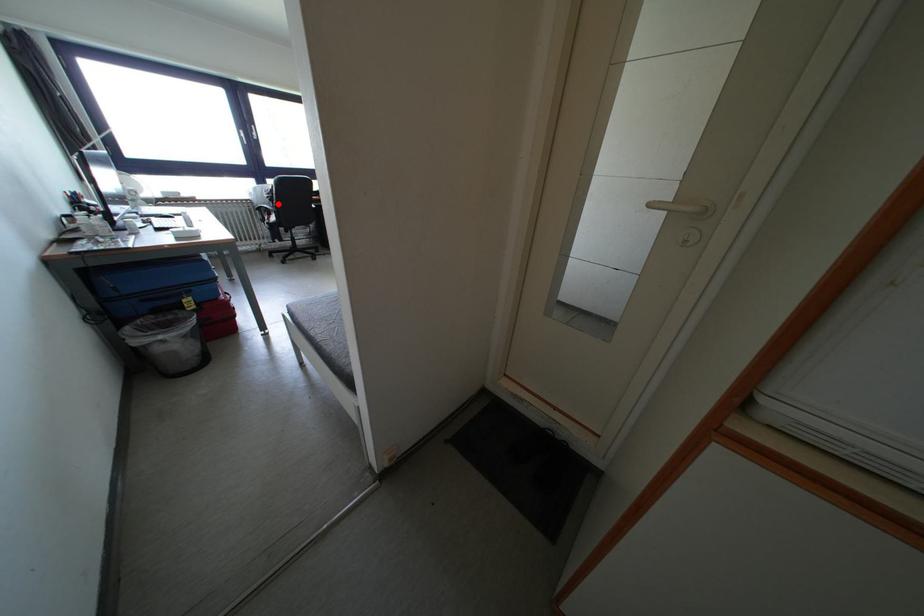
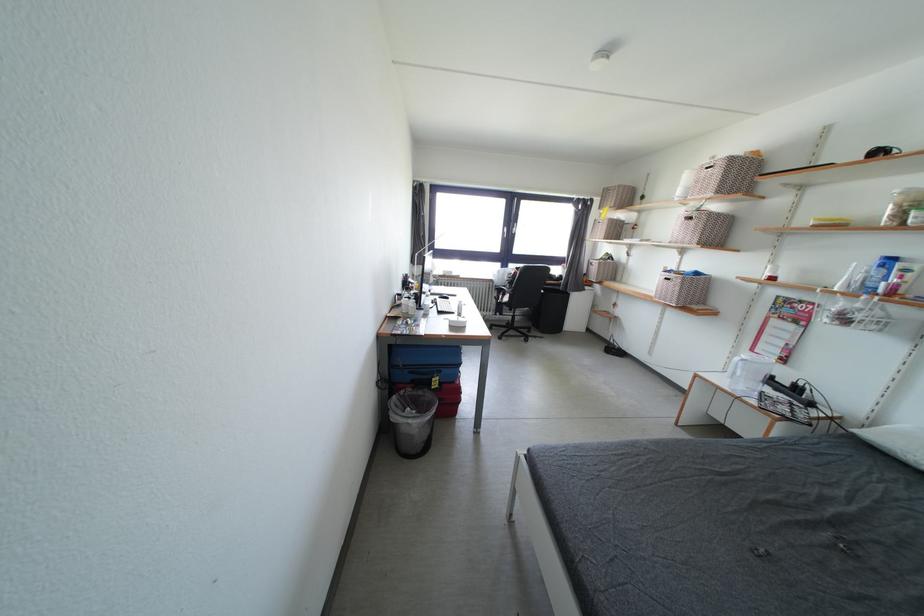
In the second image, find the point that corresponds to the highlighted location in the first image.

(517, 286)